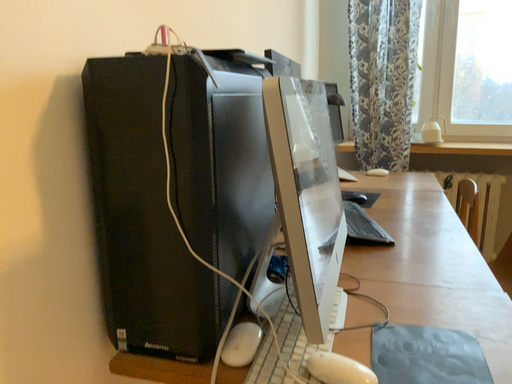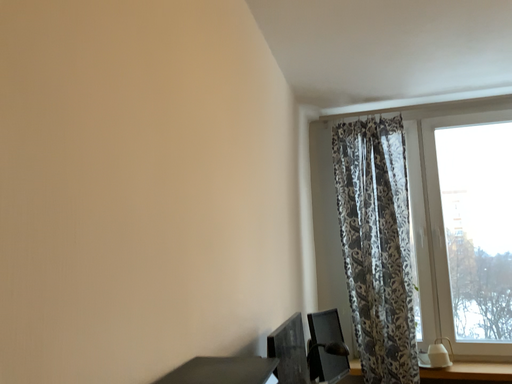
Question: How did the camera likely rotate when shooting the video?

Choices:
 (A) rotated downward
 (B) rotated upward

Answer: (B)